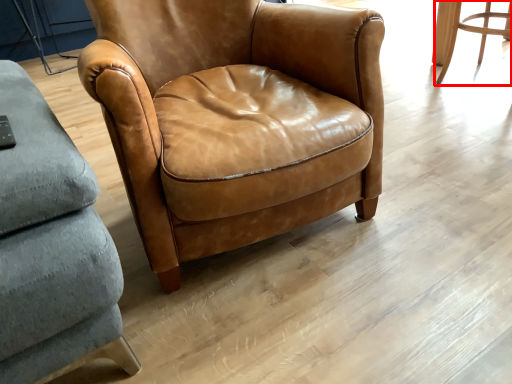
Question: From the image's perspective, considering the relative positions of chair (annotated by the red box) and chair in the image provided, where is chair (annotated by the red box) located with respect to the staircase?

Choices:
 (A) below
 (B) above

Answer: (B)